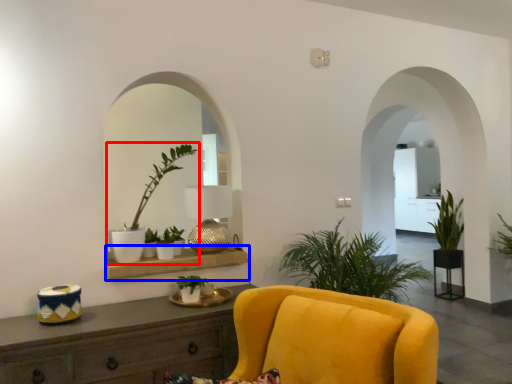
Question: Which object is closer to the camera taking this photo, houseplant (highlighted by a red box) or shelf (highlighted by a blue box)?

Choices:
 (A) houseplant
 (B) shelf

Answer: (B)